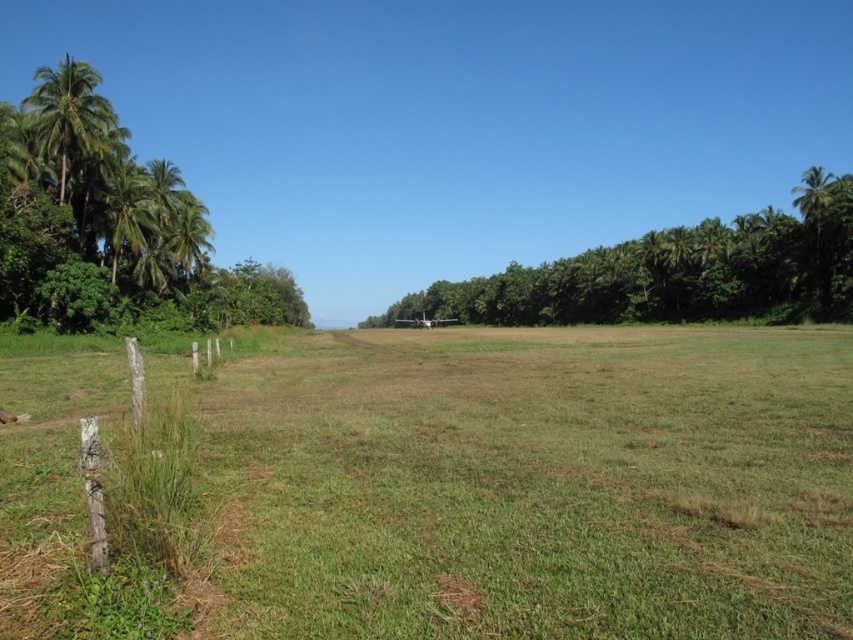
Between weathered wood fence at lower left and green leafy palm tree at right, which one is positioned lower?

Positioned lower is weathered wood fence at lower left.

Is weathered wood fence at lower left positioned at the back of green leafy palm tree at right?

No, it is not.

Between point (111, 516) and point (824, 257), which one is positioned in front?

Point (111, 516) is more forward.

Where is `weathered wood fence at lower left`? The height and width of the screenshot is (640, 853). weathered wood fence at lower left is located at coordinates pos(146,481).

Who is positioned more to the right, green grassy field at center or green leafy trees at center?

green leafy trees at center is more to the right.

Does point (840, 492) come closer to viewer compared to point (817, 202)?

That is True.

What are the coordinates of `green grassy field at center` in the screenshot? It's located at (527, 483).

Is the position of green grassy field at center more distant than that of weathered wood fence at lower left?

No, green grassy field at center is closer to the viewer.

Can you confirm if green grassy field at center is smaller than weathered wood fence at lower left?

Incorrect, green grassy field at center is not smaller in size than weathered wood fence at lower left.

Which is behind, point (646, 490) or point (122, 465)?

Positioned behind is point (646, 490).

The image size is (853, 640). I want to click on green grassy field at center, so click(x=527, y=483).